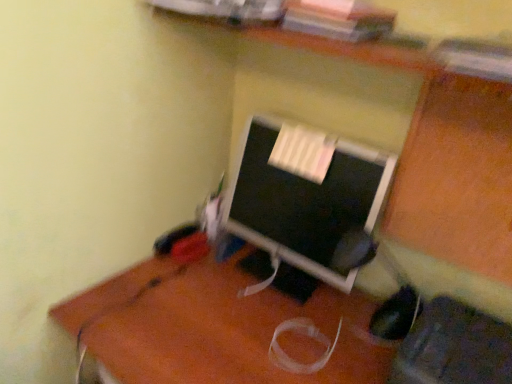
Where is `vacant location below matte black monitor at center (from a real-world perspective)`? This screenshot has height=384, width=512. vacant location below matte black monitor at center (from a real-world perspective) is located at coordinates (282, 270).